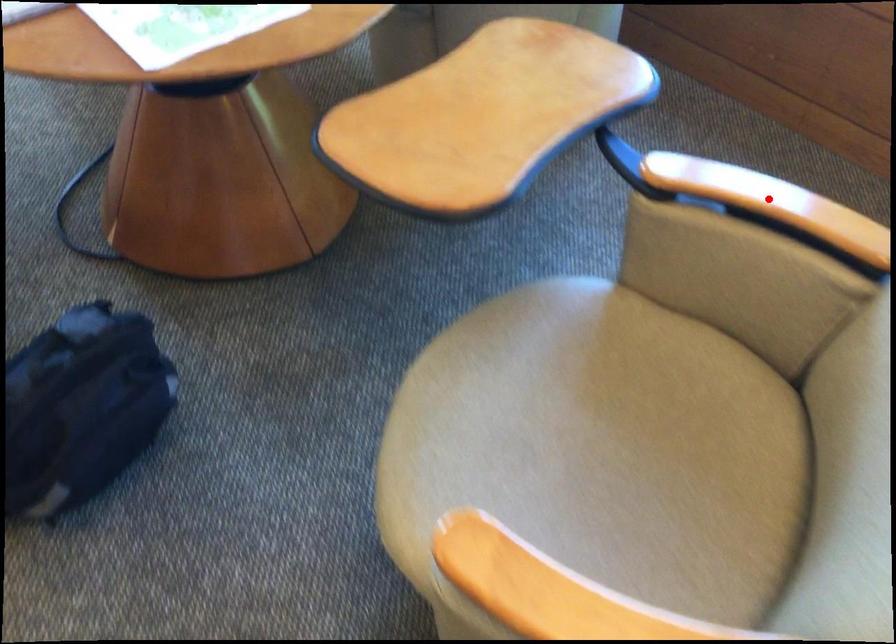
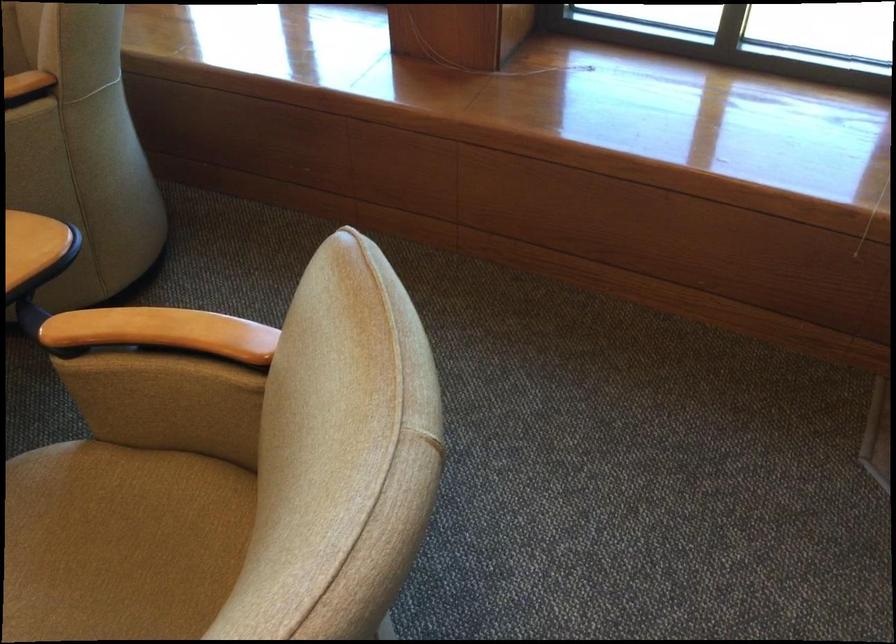
Find the pixel in the second image that matches the highlighted location in the first image.

(161, 332)